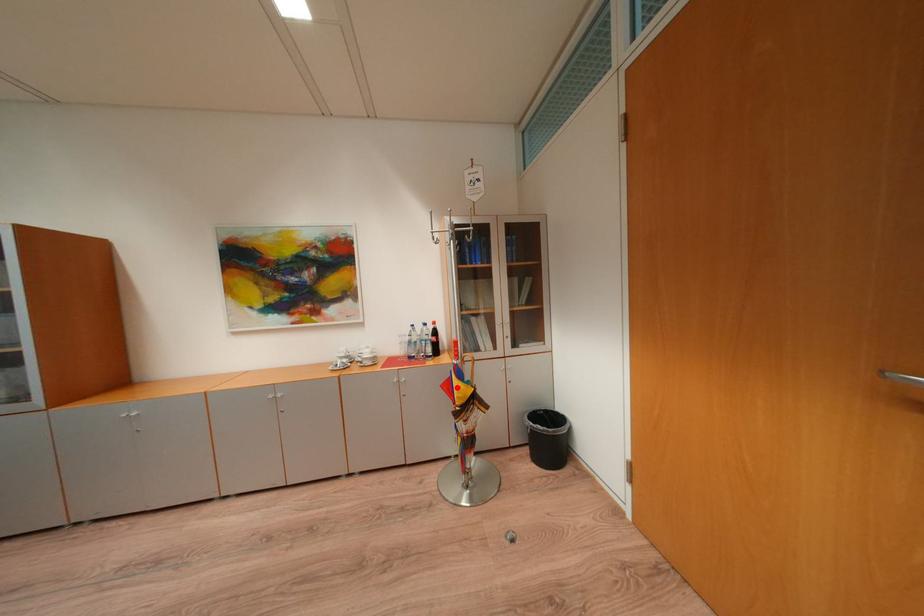
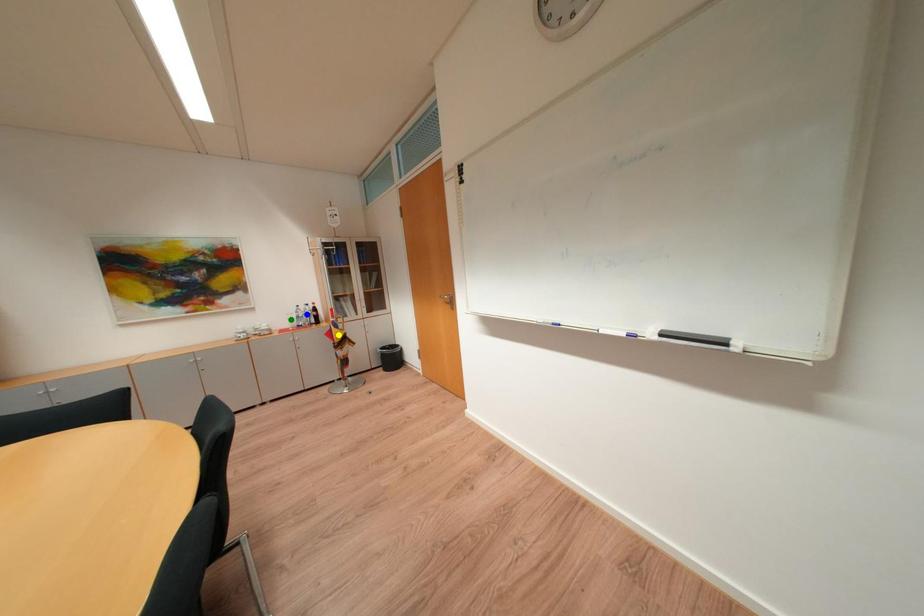
Question: I am providing you with two images of the same scene from different viewpoints. A red point is marked on the first image. You are given multiple points on the second image. Which point in image 2 represents the same 3d spot as the red point in image 1?

Choices:
 (A) green point
 (B) yellow point
 (C) blue point

Answer: (B)